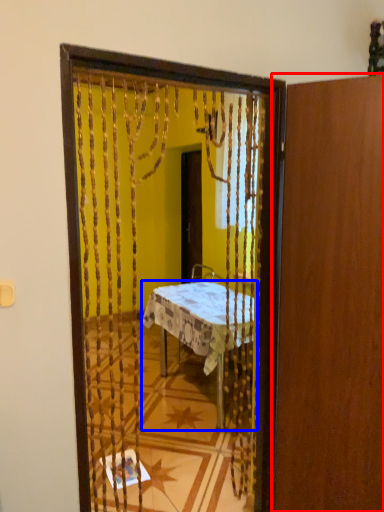
Question: Which object appears farthest to the camera in this image, door (highlighted by a red box) or desk (highlighted by a blue box)?

Choices:
 (A) door
 (B) desk

Answer: (B)